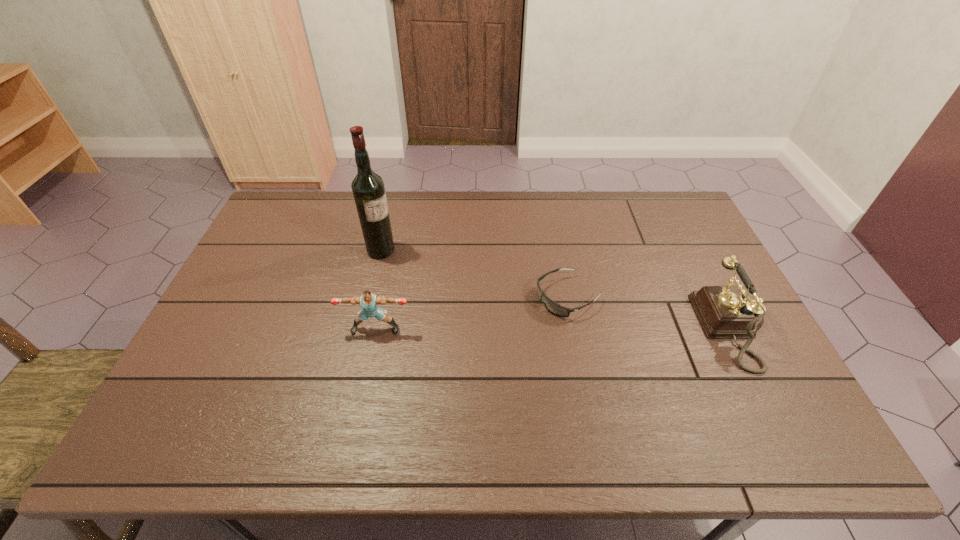
You are a GUI agent. You are given a task and a screenshot of the screen. Output one action in this format:
    pyautogui.click(x=<x>, y=<y>)
    Task: Click on the free region that satisfies the following two spatial constraints: 1. on the front side of the shortest object; 2. on the dial of the telephone
    This screenshot has height=540, width=960.
    Given the screenshot: What is the action you would take?
    (574, 329)